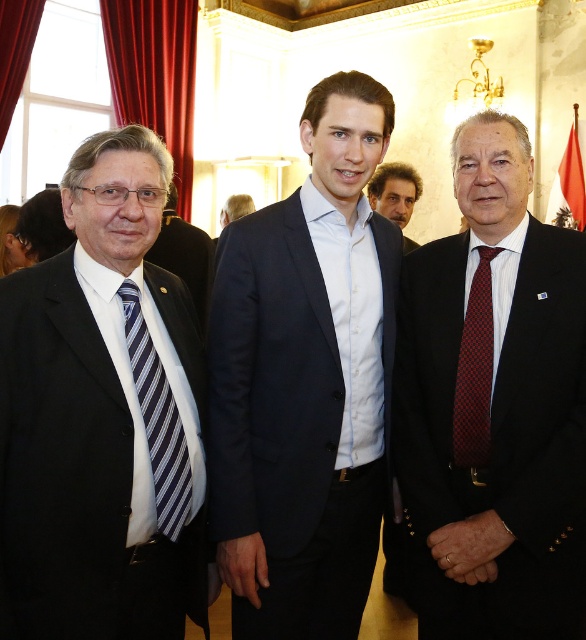
You are an event planner arranging seating for a meeting. You need to seat the navy blue suit at center and the blue striped tie at left in a row. Based on their positions in the image, which one should be seated to the left side of the row?

The blue striped tie at left should be seated to the left side of the row because in the image, the navy blue suit at center is positioned to the right of the blue striped tie at left.

You are an event planner arranging a photo shoot in the same room as the scene. You need to place a backdrop exactly where the navy blue suit at center is currently standing. What coordinates should you use for the backdrop placement?

The navy blue suit at center is positioned at coordinates point [305,380], so the backdrop should be placed at those coordinates.